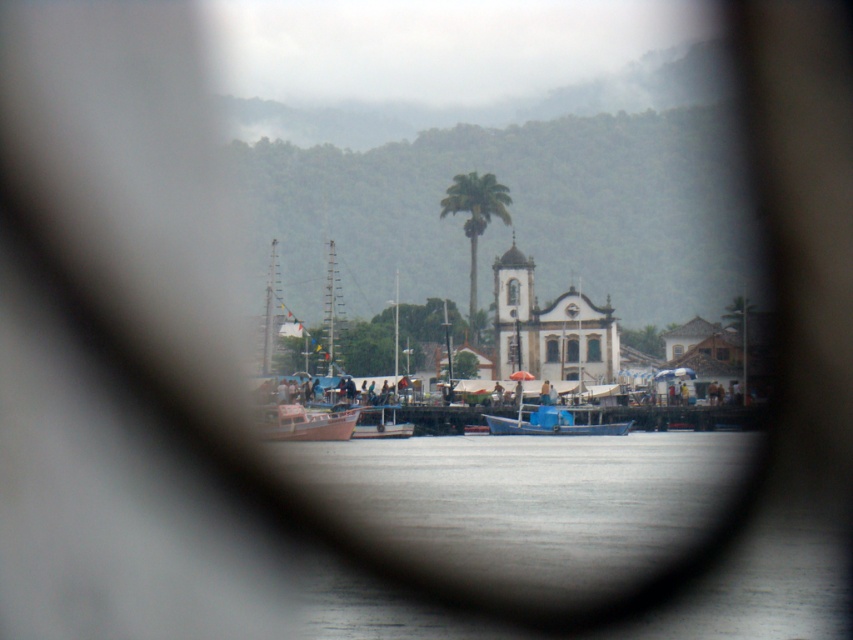
Question: Which point appears closest to the camera in this image?

Choices:
 (A) (276, 429)
 (B) (407, 435)
 (C) (531, 429)

Answer: (A)

Question: Can you confirm if blue matte boat at center is bigger than white matte boat at center?

Choices:
 (A) no
 (B) yes

Answer: (B)

Question: Which point is farther to the camera?

Choices:
 (A) (271, 410)
 (B) (399, 428)
 (C) (468, 337)
 (D) (584, 429)

Answer: (C)

Question: Which point is farther to the camera?

Choices:
 (A) white matte boat at center
 (B) blue matte boat at center
 (C) green leafy palm tree at center

Answer: (C)

Question: Considering the relative positions of green leafy palm tree at center and white matte boat at center in the image provided, where is green leafy palm tree at center located with respect to white matte boat at center?

Choices:
 (A) below
 (B) above

Answer: (B)

Question: Is wooden boat at center closer to the viewer compared to blue matte boat at center?

Choices:
 (A) yes
 (B) no

Answer: (A)